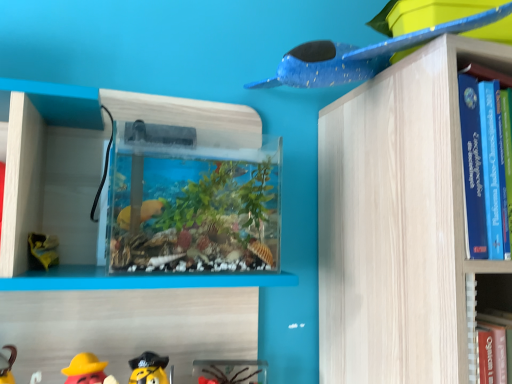
This screenshot has height=384, width=512. Describe the element at coordinates (361, 55) in the screenshot. I see `blue speckled plastic airplane at upper right, the 1th toy when ordered from top to bottom` at that location.

This screenshot has width=512, height=384. In order to click on translucent plastic toy at lower center, acting as the 1th toy starting from the bottom in this screenshot , I will do `click(224, 376)`.

Between blue speckled plastic airplane at upper right, which is the 3th toy in bottom-to-top order, and translucent plastic toy at lower center, positioned as the third toy in top-to-bottom order, which one has larger width?

blue speckled plastic airplane at upper right, which is the 3th toy in bottom-to-top order, is wider.

Is blue speckled plastic airplane at upper right, acting as the third toy starting from the left, to the left of translucent plastic toy at lower center, positioned as the second toy in right-to-left order, from the viewer's perspective?

In fact, blue speckled plastic airplane at upper right, acting as the third toy starting from the left, is to the right of translucent plastic toy at lower center, positioned as the second toy in right-to-left order.

Does blue speckled plastic airplane at upper right, which is the 3th toy in bottom-to-top order, turn towards translucent plastic toy at lower center, positioned as the third toy in top-to-bottom order?

Answer: No, blue speckled plastic airplane at upper right, which is the 3th toy in bottom-to-top order, is not oriented towards translucent plastic toy at lower center, positioned as the third toy in top-to-bottom order.

From the image's perspective, would you say blue speckled plastic airplane at upper right, acting as the third toy starting from the left, is positioned over translucent plastic toy at lower center, which is the 2th toy in left-to-right order?

Correct, blue speckled plastic airplane at upper right, acting as the third toy starting from the left, appears higher than translucent plastic toy at lower center, which is the 2th toy in left-to-right order, in the image.

Considering the relative positions of blue speckled plastic airplane at upper right, acting as the third toy starting from the left, and rubber duck at lower left, the 3th toy positioned from the right, in the image provided, is blue speckled plastic airplane at upper right, acting as the third toy starting from the left, behind rubber duck at lower left, the 3th toy positioned from the right,?

No, it is in front of rubber duck at lower left, the 3th toy positioned from the right.

In the scene shown: Does blue speckled plastic airplane at upper right, acting as the third toy starting from the left, turn towards rubber duck at lower left, the 2th toy in the top-to-bottom sequence?

No, blue speckled plastic airplane at upper right, acting as the third toy starting from the left, is not aimed at rubber duck at lower left, the 2th toy in the top-to-bottom sequence.

Is point (347, 54) positioned before point (85, 367)?

No, (347, 54) is behind (85, 367).

Can you confirm if blue speckled plastic airplane at upper right, the 1th toy positioned from the right, is wider than rubber duck at lower left, the 3th toy positioned from the right?

Yes, blue speckled plastic airplane at upper right, the 1th toy positioned from the right, is wider than rubber duck at lower left, the 3th toy positioned from the right.

Between translucent plastic toy at lower center, positioned as the second toy in right-to-left order, and rubber duck at lower left, the 1th toy positioned from the left, which one has smaller width?

rubber duck at lower left, the 1th toy positioned from the left.

From a real-world perspective, is translucent plastic toy at lower center, which is the 2th toy in left-to-right order, beneath rubber duck at lower left, the 1th toy positioned from the left?

Correct, in the physical world, translucent plastic toy at lower center, which is the 2th toy in left-to-right order, is lower than rubber duck at lower left, the 1th toy positioned from the left.

Does point (211, 374) come behind point (83, 357)?

Yes, it is.

Would you say rubber duck at lower left, the 2th toy in the top-to-bottom sequence, is outside blue speckled plastic airplane at upper right, acting as the third toy starting from the left?

That's correct, rubber duck at lower left, the 2th toy in the top-to-bottom sequence, is outside of blue speckled plastic airplane at upper right, acting as the third toy starting from the left.

From a real-world perspective, who is located higher, rubber duck at lower left, the 3th toy positioned from the right, or blue speckled plastic airplane at upper right, the 1th toy positioned from the right?

blue speckled plastic airplane at upper right, the 1th toy positioned from the right.

Are rubber duck at lower left, the 1th toy positioned from the left, and blue speckled plastic airplane at upper right, acting as the third toy starting from the left, making contact?

rubber duck at lower left, the 1th toy positioned from the left, and blue speckled plastic airplane at upper right, acting as the third toy starting from the left, are not in contact.

Between rubber duck at lower left, which is counted as the 2th toy, starting from the bottom, and blue speckled plastic airplane at upper right, the 1th toy positioned from the right, which one appears on the right side from the viewer's perspective?

Positioned to the right is blue speckled plastic airplane at upper right, the 1th toy positioned from the right.

Which is in front, point (65, 371) or point (225, 378)?

Point (65, 371)

From the image's perspective, between rubber duck at lower left, the 3th toy positioned from the right, and translucent plastic toy at lower center, acting as the 1th toy starting from the bottom, who is located below?

translucent plastic toy at lower center, acting as the 1th toy starting from the bottom.

Would you say rubber duck at lower left, the 3th toy positioned from the right, is outside translucent plastic toy at lower center, positioned as the second toy in right-to-left order?

Indeed, rubber duck at lower left, the 3th toy positioned from the right, is completely outside translucent plastic toy at lower center, positioned as the second toy in right-to-left order.

Can you confirm if translucent plastic toy at lower center, acting as the 1th toy starting from the bottom, is taller than blue speckled plastic airplane at upper right, the 1th toy when ordered from top to bottom?

In fact, translucent plastic toy at lower center, acting as the 1th toy starting from the bottom, may be shorter than blue speckled plastic airplane at upper right, the 1th toy when ordered from top to bottom.

From the image's perspective, which is above, translucent plastic toy at lower center, which is the 2th toy in left-to-right order, or blue speckled plastic airplane at upper right, the 1th toy when ordered from top to bottom?

blue speckled plastic airplane at upper right, the 1th toy when ordered from top to bottom, from the image's perspective.

How many degrees apart are the facing directions of translucent plastic toy at lower center, positioned as the second toy in right-to-left order, and blue speckled plastic airplane at upper right, the 1th toy positioned from the right?

0.00166 degrees separate the facing orientations of translucent plastic toy at lower center, positioned as the second toy in right-to-left order, and blue speckled plastic airplane at upper right, the 1th toy positioned from the right.

Identify the location of the 2nd toy positioned below the blue speckled plastic airplane at upper right, the 1th toy when ordered from top to bottom (from a real-world perspective). tap(224, 376).

From the blue speckled plastic airplane at upper right, the 1th toy when ordered from top to bottom, count 1st toys backward and point to it. Please provide its 2D coordinates.

[(85, 369)]

From the image, which object appears to be farther from rubber duck at lower left, the 2th toy in the top-to-bottom sequence, translucent plastic toy at lower center, acting as the 1th toy starting from the bottom, or blue speckled plastic airplane at upper right, the 1th toy positioned from the right?

blue speckled plastic airplane at upper right, the 1th toy positioned from the right, is positioned further to the anchor rubber duck at lower left, the 2th toy in the top-to-bottom sequence.

When comparing their distances from blue speckled plastic airplane at upper right, acting as the third toy starting from the left, does translucent plastic toy at lower center, positioned as the third toy in top-to-bottom order, or rubber duck at lower left, which is counted as the 2th toy, starting from the bottom, seem further?

Among the two, translucent plastic toy at lower center, positioned as the third toy in top-to-bottom order, is located further to blue speckled plastic airplane at upper right, acting as the third toy starting from the left.

When comparing their distances from translucent plastic toy at lower center, positioned as the third toy in top-to-bottom order, does blue speckled plastic airplane at upper right, acting as the third toy starting from the left, or rubber duck at lower left, the 2th toy in the top-to-bottom sequence, seem further?

The object further to translucent plastic toy at lower center, positioned as the third toy in top-to-bottom order, is blue speckled plastic airplane at upper right, acting as the third toy starting from the left.

Looking at the image, which one is located further to rubber duck at lower left, which is counted as the 2th toy, starting from the bottom, blue speckled plastic airplane at upper right, which is the 3th toy in bottom-to-top order, or translucent plastic toy at lower center, which is the 2th toy in left-to-right order?

Among the two, blue speckled plastic airplane at upper right, which is the 3th toy in bottom-to-top order, is located further to rubber duck at lower left, which is counted as the 2th toy, starting from the bottom.

Based on their spatial positions, is rubber duck at lower left, the 1th toy positioned from the left, or translucent plastic toy at lower center, positioned as the second toy in right-to-left order, further from blue speckled plastic airplane at upper right, the 1th toy when ordered from top to bottom?

translucent plastic toy at lower center, positioned as the second toy in right-to-left order, is positioned further to the anchor blue speckled plastic airplane at upper right, the 1th toy when ordered from top to bottom.

From the picture: When comparing their distances from translucent plastic toy at lower center, which is the 2th toy in left-to-right order, does rubber duck at lower left, the 2th toy in the top-to-bottom sequence, or blue speckled plastic airplane at upper right, the 1th toy when ordered from top to bottom, seem closer?

The object closer to translucent plastic toy at lower center, which is the 2th toy in left-to-right order, is rubber duck at lower left, the 2th toy in the top-to-bottom sequence.

Identify the location of toy between blue speckled plastic airplane at upper right, which is the 3th toy in bottom-to-top order, and translucent plastic toy at lower center, positioned as the third toy in top-to-bottom order, in the vertical direction. (85, 369).